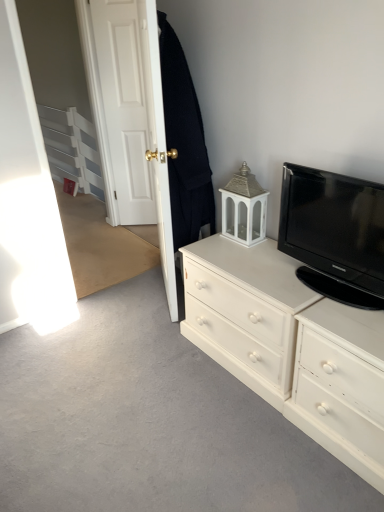
Question: Considering the positions of point (360, 399) and point (360, 210), is point (360, 399) closer or farther from the camera than point (360, 210)?

Choices:
 (A) closer
 (B) farther

Answer: (A)

Question: Considering the relative positions of white painted wood drawer at right and black glossy tv at upper right in the image provided, is white painted wood drawer at right to the left or to the right of black glossy tv at upper right?

Choices:
 (A) right
 (B) left

Answer: (A)

Question: Estimate the real-world distances between objects in this image. Which object is farther from the white wooden door at upper left, acting as the second door starting from the left?

Choices:
 (A) white wood door at upper left, which is counted as the first door, starting from the left
 (B) black glossy tv at upper right
 (C) white painted wood chest of drawers at right
 (D) white painted wood drawer at right
 (E) black woolen robe at upper left

Answer: (D)

Question: Which of these objects is positioned farthest from the white wooden door at upper left, acting as the 1th door starting from the right?

Choices:
 (A) white painted wood chest of drawers at right
 (B) black glossy tv at upper right
 (C) black woolen robe at upper left
 (D) white wood door at upper left, which appears as the 2th door when viewed from the right
 (E) white painted wood drawer at right

Answer: (E)